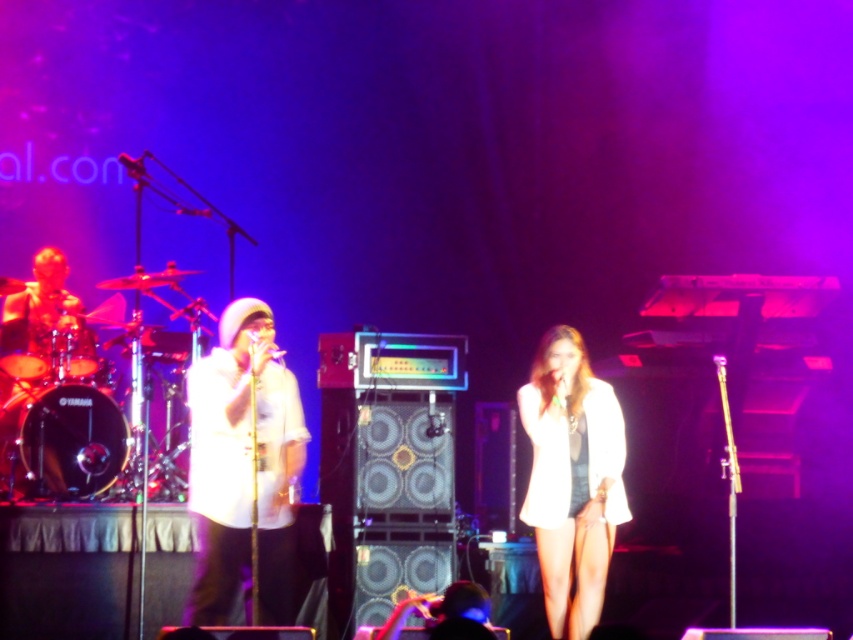
Is white matte shirt at center taller than white fabric dress at center?

Yes.

Is white matte shirt at center wider than white fabric dress at center?

Indeed, white matte shirt at center has a greater width compared to white fabric dress at center.

This screenshot has height=640, width=853. I want to click on white matte shirt at center, so pyautogui.click(x=242, y=468).

Where is `white matte shirt at center`? white matte shirt at center is located at coordinates (242, 468).